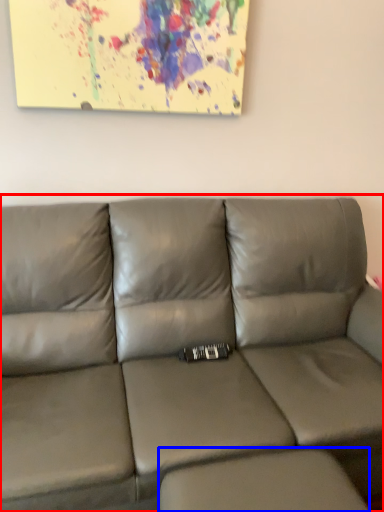
Question: Which of the following is the closest to the observer, studio couch (highlighted by a red box) or footrest (highlighted by a blue box)?

Choices:
 (A) studio couch
 (B) footrest

Answer: (A)